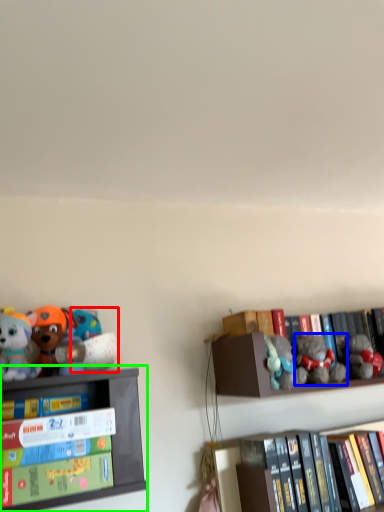
Question: Which is nearer to the toy (highlighted by a red box)? toy (highlighted by a blue box) or shelf (highlighted by a green box).

Choices:
 (A) toy
 (B) shelf

Answer: (B)